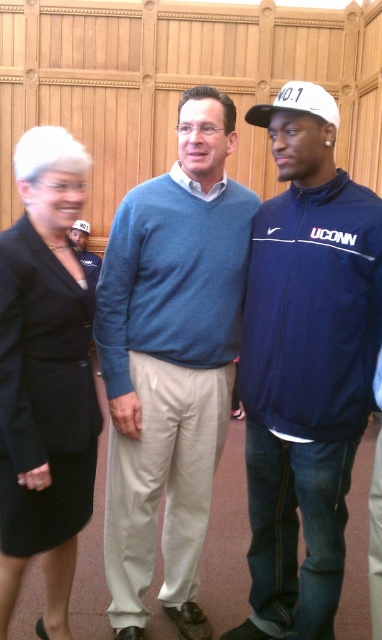
Question: Can you confirm if black fabric suit at left is positioned below matte blue sweater at center?

Choices:
 (A) no
 (B) yes

Answer: (B)

Question: Which is nearer to the blue sweater at center?

Choices:
 (A) black fabric suit at left
 (B) white matte baseball cap at upper right
 (C) matte blue sweater at center
 (D) white matte baseball cap at upper center

Answer: (A)

Question: Which object is the closest to the white matte baseball cap at upper center?

Choices:
 (A) navy blue jacket at center
 (B) matte blue sweater at center
 (C) white matte baseball cap at upper right
 (D) blue sweater at center

Answer: (B)

Question: Which object is closer to the camera taking this photo?

Choices:
 (A) matte blue sweater at center
 (B) navy blue jacket at center

Answer: (B)

Question: Is navy blue jacket at center wider than white matte baseball cap at upper right?

Choices:
 (A) yes
 (B) no

Answer: (A)

Question: Does navy blue jacket at center have a lesser width compared to white matte baseball cap at upper center?

Choices:
 (A) yes
 (B) no

Answer: (B)